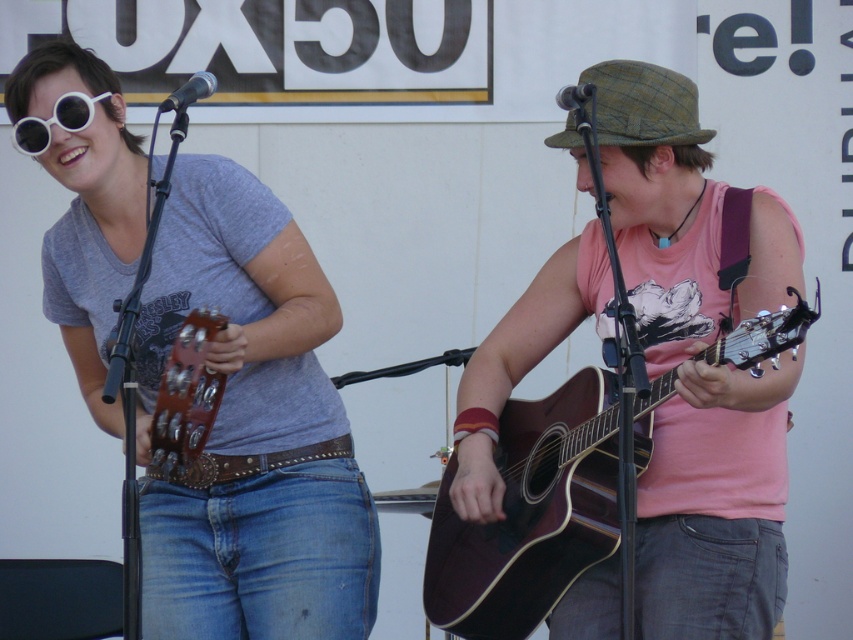
Locate an element on the screen. The width and height of the screenshot is (853, 640). dark brown acoustic guitar at center is located at coordinates (531, 515).

Does green plaid hat at upper right have a smaller size compared to wooden acoustic guitar at left?

Indeed, green plaid hat at upper right has a smaller size compared to wooden acoustic guitar at left.

Does green plaid hat at upper right have a larger size compared to wooden acoustic guitar at left?

No.

You are a GUI agent. You are given a task and a screenshot of the screen. Output one action in this format:
    pyautogui.click(x=<x>, y=<y>)
    Task: Click on the green plaid hat at upper right
    The height and width of the screenshot is (640, 853).
    Given the screenshot: What is the action you would take?
    pyautogui.click(x=643, y=104)

Who is taller, matte gray t-shirt at center or wooden acoustic guitar at left?

Standing taller between the two is matte gray t-shirt at center.

Does matte gray t-shirt at center have a larger size compared to wooden acoustic guitar at left?

Yes, matte gray t-shirt at center is bigger than wooden acoustic guitar at left.

Locate an element on the screen. The width and height of the screenshot is (853, 640). matte gray t-shirt at center is located at coordinates (250, 429).